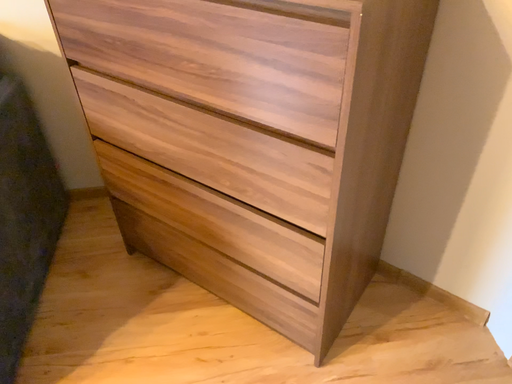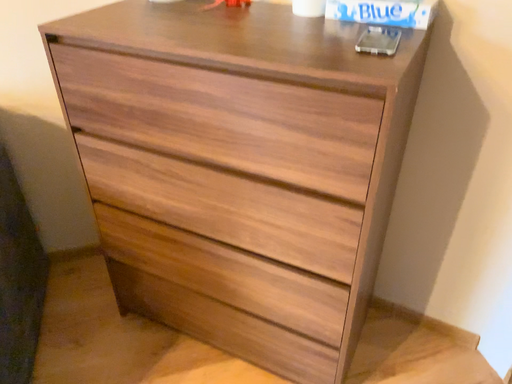
Question: Which way did the camera rotate in the video?

Choices:
 (A) rotated right
 (B) rotated left

Answer: (A)